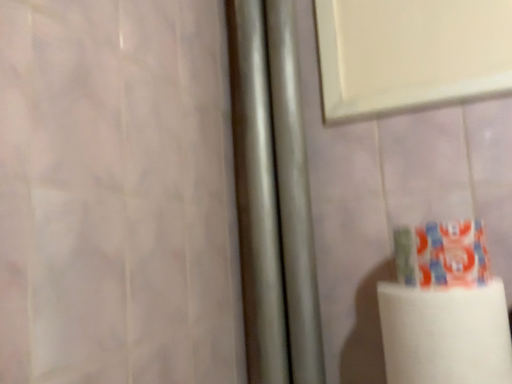
Question: Is multicolored plastic toothpaste at lower right in front of or behind white matte paper towel at lower right in the image?

Choices:
 (A) behind
 (B) front

Answer: (A)

Question: Is point (406, 231) closer or farther from the camera than point (509, 382)?

Choices:
 (A) farther
 (B) closer

Answer: (A)

Question: Which is correct: multicolored plastic toothpaste at lower right is inside white matte paper towel at lower right, or outside of it?

Choices:
 (A) inside
 (B) outside

Answer: (B)

Question: Considering the positions of white matte paper towel at lower right and multicolored plastic toothpaste at lower right in the image, is white matte paper towel at lower right taller or shorter than multicolored plastic toothpaste at lower right?

Choices:
 (A) tall
 (B) short

Answer: (A)

Question: From a real-world perspective, is white matte paper towel at lower right above or below multicolored plastic toothpaste at lower right?

Choices:
 (A) above
 (B) below

Answer: (B)

Question: Considering the positions of point (406, 314) and point (394, 238), is point (406, 314) closer or farther from the camera than point (394, 238)?

Choices:
 (A) closer
 (B) farther

Answer: (A)

Question: Considering the positions of white matte paper towel at lower right and multicolored plastic toothpaste at lower right in the image, is white matte paper towel at lower right wider or thinner than multicolored plastic toothpaste at lower right?

Choices:
 (A) wide
 (B) thin

Answer: (A)